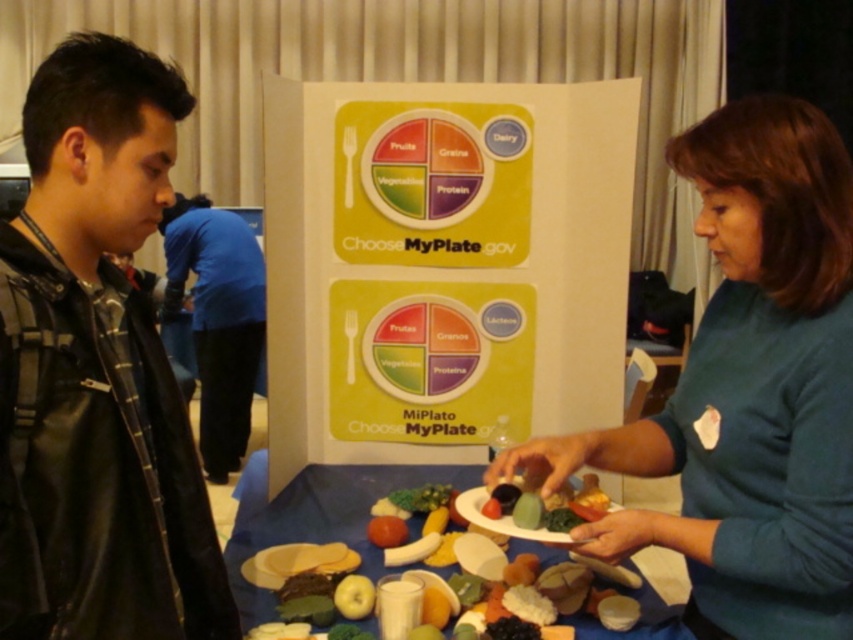
Question: Considering the real-world distances, which object is closest to the black leather jacket at left?

Choices:
 (A) teal fabric shirt at center
 (B) plastic food model at center
 (C) blue fabric pants at left

Answer: (B)

Question: Does teal fabric shirt at center appear on the right side of blue fabric pants at left?

Choices:
 (A) no
 (B) yes

Answer: (B)

Question: Is black leather jacket at left thinner than plastic food model at center?

Choices:
 (A) yes
 (B) no

Answer: (A)

Question: Is black leather jacket at left smaller than teal fabric shirt at center?

Choices:
 (A) no
 (B) yes

Answer: (B)

Question: Which point is closer to the camera taking this photo?

Choices:
 (A) (735, 492)
 (B) (3, 560)

Answer: (B)

Question: Which of the following is the closest to the observer?

Choices:
 (A) plastic food model at center
 (B) black leather jacket at left
 (C) teal fabric shirt at center

Answer: (B)